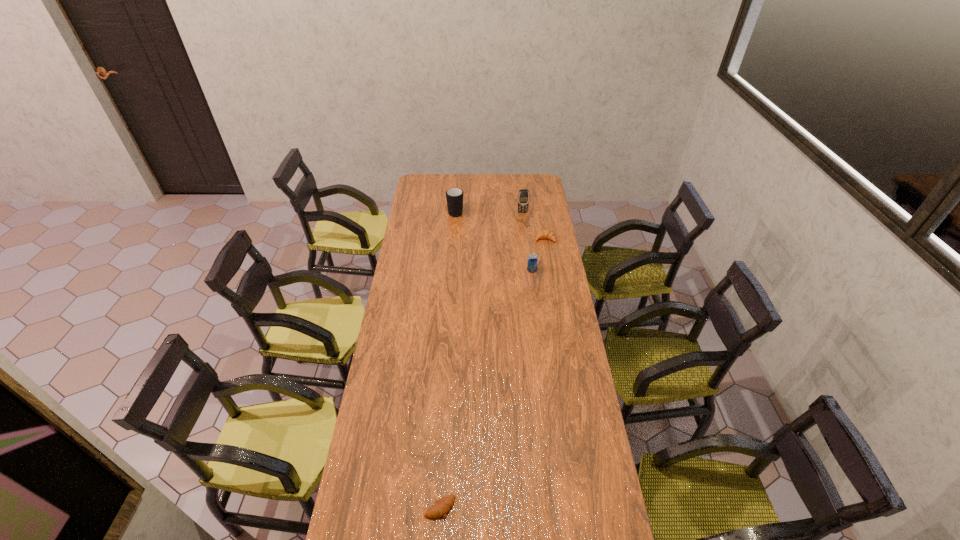
This screenshot has height=540, width=960. Identify the location of cellular telephone. (523, 197).

Identify the location of mug. This screenshot has height=540, width=960. (454, 196).

Image resolution: width=960 pixels, height=540 pixels. In order to click on beer can in this screenshot , I will do `click(532, 261)`.

This screenshot has width=960, height=540. What are the coordinates of `the fourth farthest object` in the screenshot? It's located at (532, 261).

You are a GUI agent. You are given a task and a screenshot of the screen. Output one action in this format:
    pyautogui.click(x=<x>, y=<y>)
    Task: Click on the rightmost object
    The image size is (960, 540).
    Given the screenshot: What is the action you would take?
    pyautogui.click(x=545, y=234)

You are a GUI agent. You are given a task and a screenshot of the screen. Output one action in this format:
    pyautogui.click(x=<x>, y=<y>)
    Task: Click on the third nearest object
    
    Given the screenshot: What is the action you would take?
    (545, 234)

Locate an element on the screen. This screenshot has width=960, height=540. the shortest object is located at coordinates (440, 507).

Identify the location of the left crescent roll. The width and height of the screenshot is (960, 540). (440, 507).

You are a GUI agent. You are given a task and a screenshot of the screen. Output one action in this format:
    pyautogui.click(x=<x>, y=<y>)
    Task: Click on the free point located on the front face of the cellular telephone
    Image resolution: width=960 pixels, height=540 pixels.
    Given the screenshot: What is the action you would take?
    pos(524,228)

Find the location of a particular element. free space located on the side of the mug with the handle is located at coordinates (457, 193).